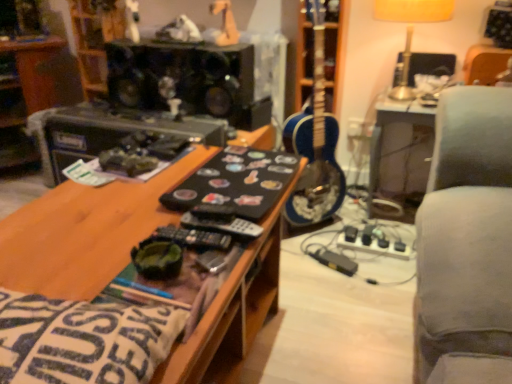
This screenshot has width=512, height=384. What are the coordinates of `vacant space positioned to the left of matte plastic toy at upper center, which is the 1th toy from right to left` in the screenshot? It's located at (186, 44).